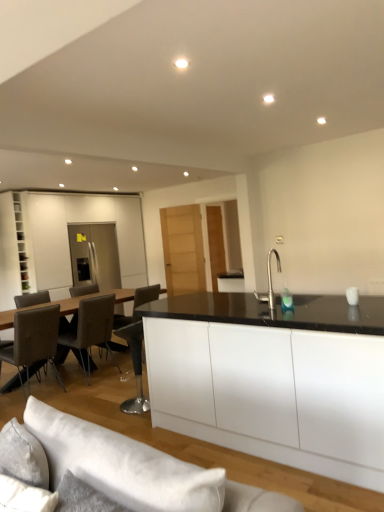
Question: Is leather/chrome chair at left, which is the third chair from right to left, looking in the opposite direction of leather at left, acting as the 2th chair starting from the right?

Choices:
 (A) no
 (B) yes

Answer: (A)

Question: From a real-world perspective, is leather/chrome chair at left, which is the 1th chair in left-to-right order, located beneath leather at left, acting as the 2th chair starting from the right?

Choices:
 (A) no
 (B) yes

Answer: (A)

Question: Considering the relative sizes of leather/chrome chair at left, which is the third chair from right to left, and leather at left, which is the second chair from left to right, in the image provided, is leather/chrome chair at left, which is the third chair from right to left, shorter than leather at left, which is the second chair from left to right,?

Choices:
 (A) yes
 (B) no

Answer: (A)

Question: From the image's perspective, would you say leather/chrome chair at left, which is the third chair from right to left, is positioned over leather at left, which is the second chair from left to right?

Choices:
 (A) yes
 (B) no

Answer: (B)

Question: Is leather/chrome chair at left, which is the 1th chair in left-to-right order, in front of leather at left, acting as the 2th chair starting from the right?

Choices:
 (A) no
 (B) yes

Answer: (B)

Question: Is leather/chrome chair at left, which is the third chair from right to left, wider than leather at left, which is the second chair from left to right?

Choices:
 (A) no
 (B) yes

Answer: (A)

Question: Considering the relative positions of white matte cabinet at left and white fabric couch at lower center in the image provided, is white matte cabinet at left to the left of white fabric couch at lower center from the viewer's perspective?

Choices:
 (A) no
 (B) yes

Answer: (B)

Question: Could you tell me if white matte cabinet at left is facing white fabric couch at lower center?

Choices:
 (A) no
 (B) yes

Answer: (A)

Question: Can you confirm if white matte cabinet at left is smaller than white fabric couch at lower center?

Choices:
 (A) no
 (B) yes

Answer: (B)

Question: Does white matte cabinet at left have a greater height compared to white fabric couch at lower center?

Choices:
 (A) yes
 (B) no

Answer: (A)

Question: Considering the relative sizes of white matte cabinet at left and white fabric couch at lower center in the image provided, is white matte cabinet at left wider than white fabric couch at lower center?

Choices:
 (A) no
 (B) yes

Answer: (A)

Question: Is white matte cabinet at left positioned beyond the bounds of white fabric couch at lower center?

Choices:
 (A) yes
 (B) no

Answer: (A)

Question: Is white matte cabinet at left shorter than leather/chrome chair at left, which is the third chair from right to left?

Choices:
 (A) no
 (B) yes

Answer: (A)